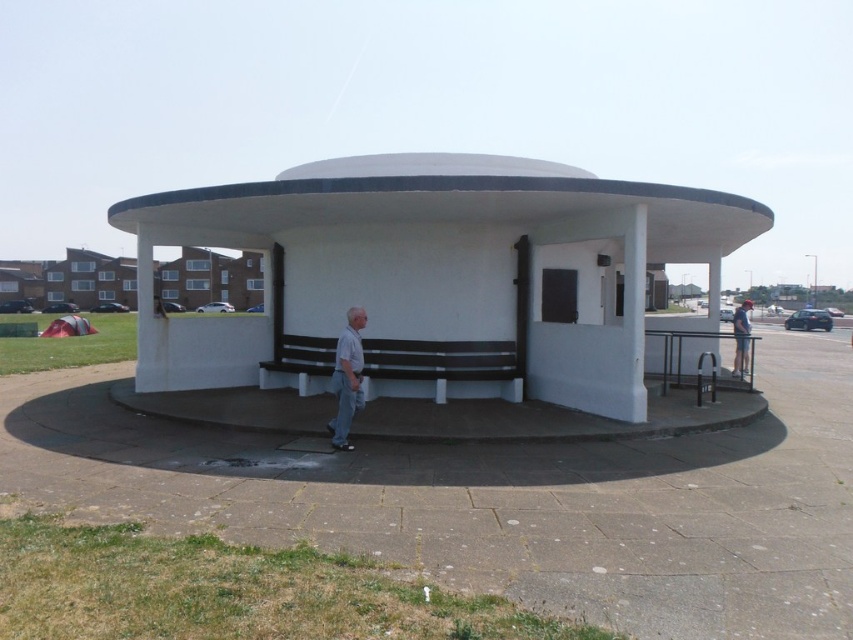
Who is more forward, [335,429] or [746,365]?

Positioned in front is point [335,429].

Can you confirm if light gray fabric pants at center is taller than light blue denim jeans at center?

No.

What do you see at coordinates (347, 378) in the screenshot? The image size is (853, 640). I see `light gray fabric pants at center` at bounding box center [347, 378].

You are a GUI agent. You are given a task and a screenshot of the screen. Output one action in this format:
    pyautogui.click(x=<x>, y=<y>)
    Task: Click on the light gray fabric pants at center
    The image size is (853, 640).
    Given the screenshot: What is the action you would take?
    pyautogui.click(x=347, y=378)

Is white matte gazebo at center closer to camera compared to light gray fabric pants at center?

No, white matte gazebo at center is further to the viewer.

Is white matte gazebo at center below light gray fabric pants at center?

No.

Locate an element on the screen. Image resolution: width=853 pixels, height=640 pixels. white matte gazebo at center is located at coordinates (437, 275).

Where is `white matte gazebo at center`? white matte gazebo at center is located at coordinates (437, 275).

Is white matte gazebo at center to the left of light blue denim jeans at center from the viewer's perspective?

Yes, white matte gazebo at center is to the left of light blue denim jeans at center.

Can you confirm if white matte gazebo at center is smaller than light blue denim jeans at center?

Actually, white matte gazebo at center might be larger than light blue denim jeans at center.

Locate an element on the screen. The height and width of the screenshot is (640, 853). white matte gazebo at center is located at coordinates (437, 275).